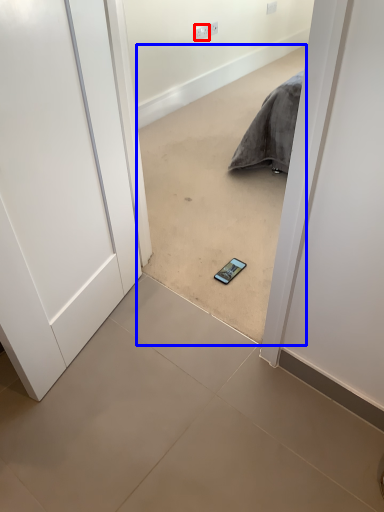
Question: Which object appears closest to the camera in this image, electric outlet (highlighted by a red box) or concrete (highlighted by a blue box)?

Choices:
 (A) electric outlet
 (B) concrete

Answer: (B)